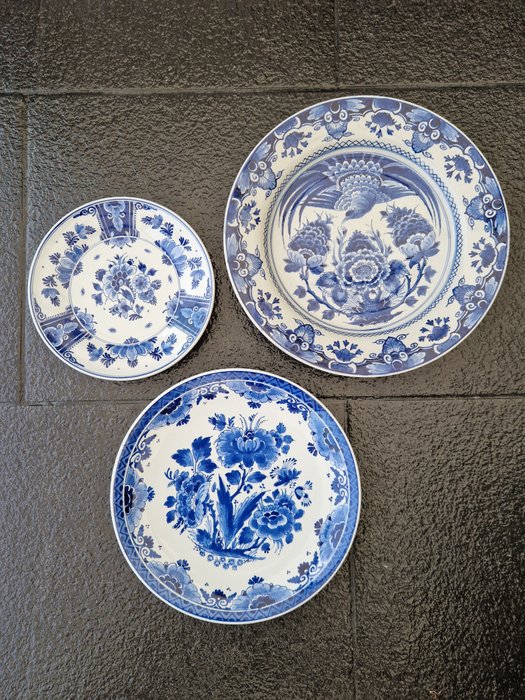
Identify the location of tile. (421, 584).